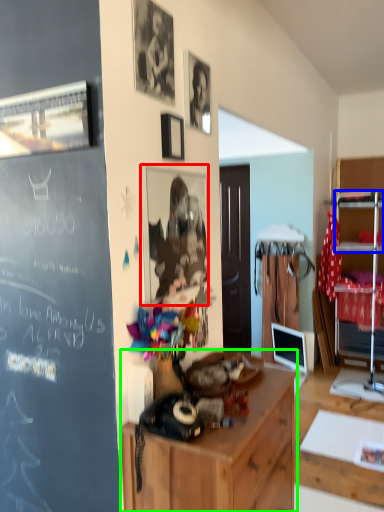
Question: Which is nearer to the picture frame (highlighted by a red box)? shelf (highlighted by a blue box) or cabinetry (highlighted by a green box).

Choices:
 (A) shelf
 (B) cabinetry

Answer: (B)